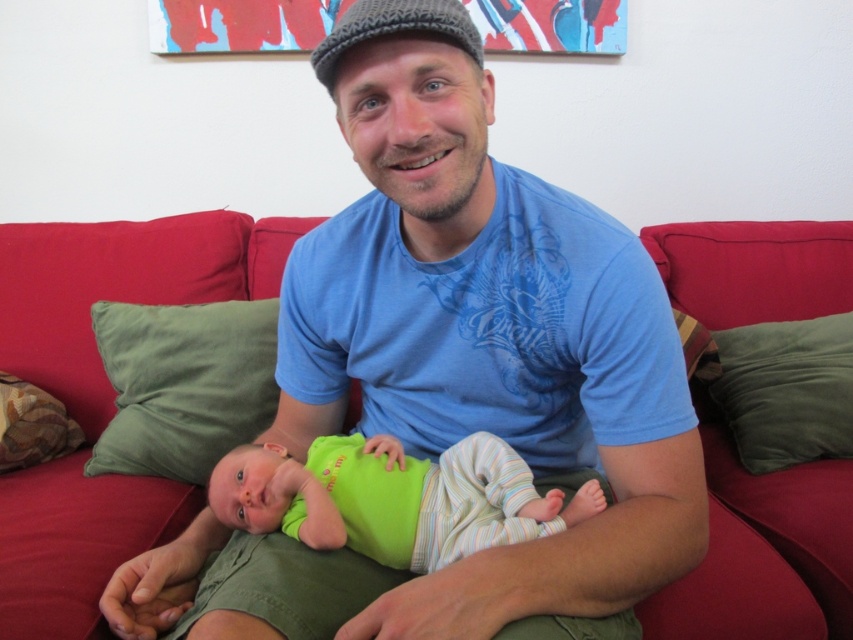
Is blue cotton shirt at center in front of green soft fabric baby at center?

Yes.

Is blue cotton shirt at center further to the viewer compared to green soft fabric baby at center?

No, blue cotton shirt at center is closer to the viewer.

Find the location of a particular element. blue cotton shirt at center is located at coordinates (454, 372).

This screenshot has height=640, width=853. I want to click on blue cotton shirt at center, so click(x=454, y=372).

Does blue cotton shirt at center come in front of patterned fabric pillow at left?

Yes, blue cotton shirt at center is closer to the viewer.

Where is `blue cotton shirt at center`? blue cotton shirt at center is located at coordinates (454, 372).

Locate an element on the screen. This screenshot has width=853, height=640. blue cotton shirt at center is located at coordinates (454, 372).

Does blue cotton shirt at center have a greater height compared to green fabric pillow at left?

Yes, blue cotton shirt at center is taller than green fabric pillow at left.

Which is behind, point (381, 104) or point (113, 458)?

The point (113, 458) is more distant.

Who is more forward, (215, 556) or (210, 458)?

Point (215, 556)

Image resolution: width=853 pixels, height=640 pixels. I want to click on blue cotton shirt at center, so click(454, 372).